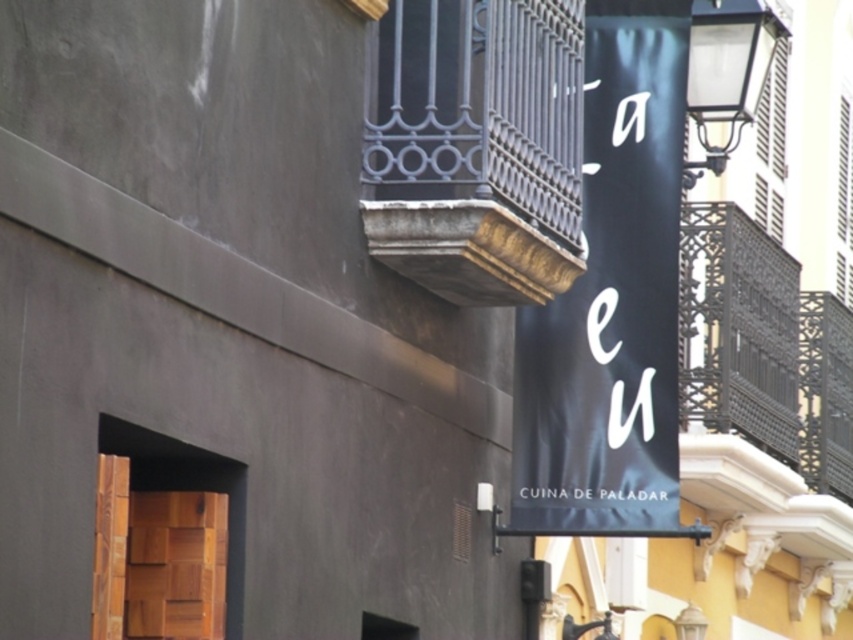
Is black fabric banner at center positioned behind dark wrought iron balcony at upper center?

Yes, black fabric banner at center is behind dark wrought iron balcony at upper center.

Which is behind, point (569, 404) or point (448, 241)?

Positioned behind is point (569, 404).

Measure the distance between black fabric banner at center and camera.

The distance of black fabric banner at center from camera is 51.27 meters.

At what (x,y) coordinates should I click in order to perform the action: click on black fabric banner at center. Please return your answer as a coordinate pair (x, y). Image resolution: width=853 pixels, height=640 pixels. Looking at the image, I should click on (611, 300).